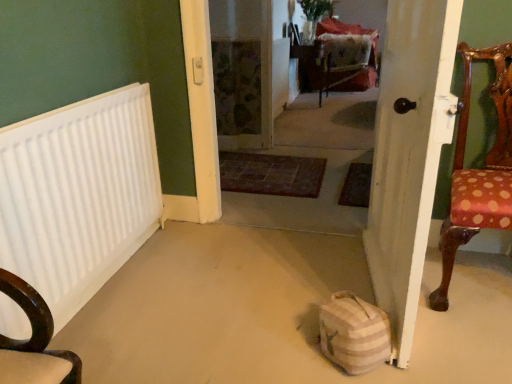
You are a GUI agent. You are given a task and a screenshot of the screen. Output one action in this format:
    pyautogui.click(x=<x>, y=<y>)
    Task: Click on the free space to the right of striped fabric bag at lower center
    Image resolution: width=512 pixels, height=384 pixels.
    Given the screenshot: What is the action you would take?
    pyautogui.click(x=420, y=361)